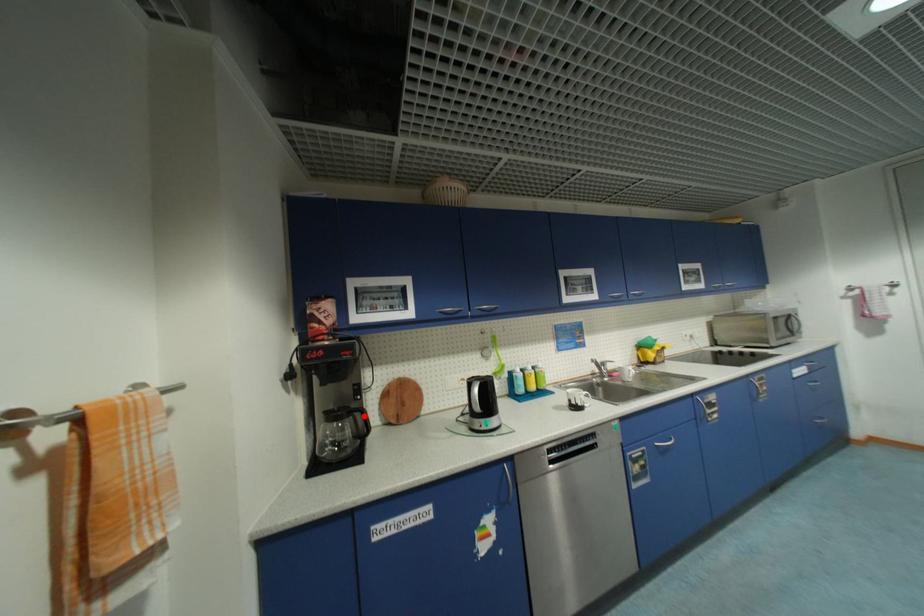
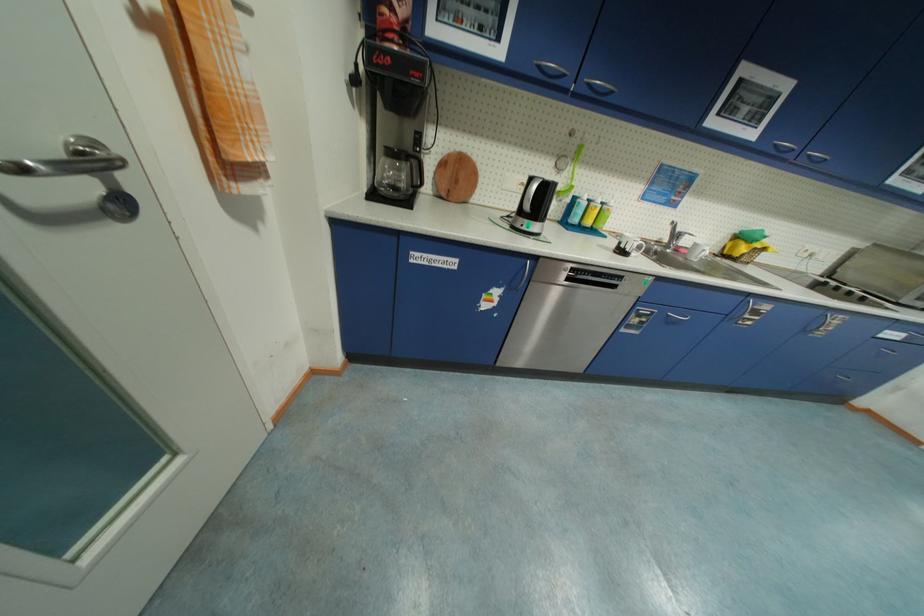
Question: I am providing you with two images of the same scene from different viewpoints. In image1, a red point is highlighted. Considering the same 3D point in image2, which of the following is correct?

Choices:
 (A) It is closer
 (B) It is farther

Answer: (A)